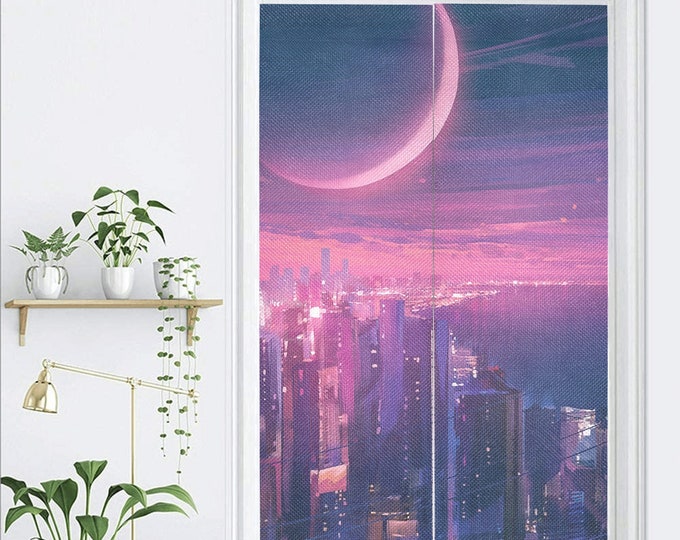
This screenshot has width=680, height=540. In order to click on green plant vines in this screenshot , I will do `click(160, 368)`, `click(167, 369)`, `click(177, 370)`, `click(187, 367)`, `click(194, 361)`.